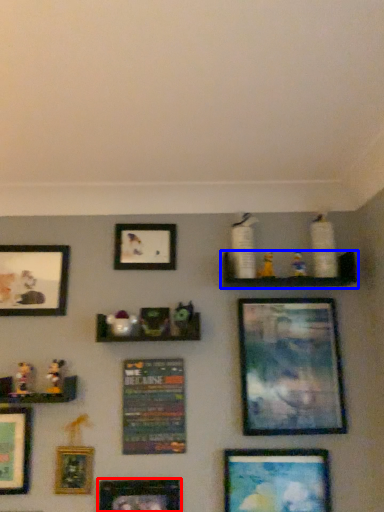
Question: Among these objects, which one is nearest to the camera, picture frame (highlighted by a red box) or shelf (highlighted by a blue box)?

Choices:
 (A) picture frame
 (B) shelf

Answer: (A)